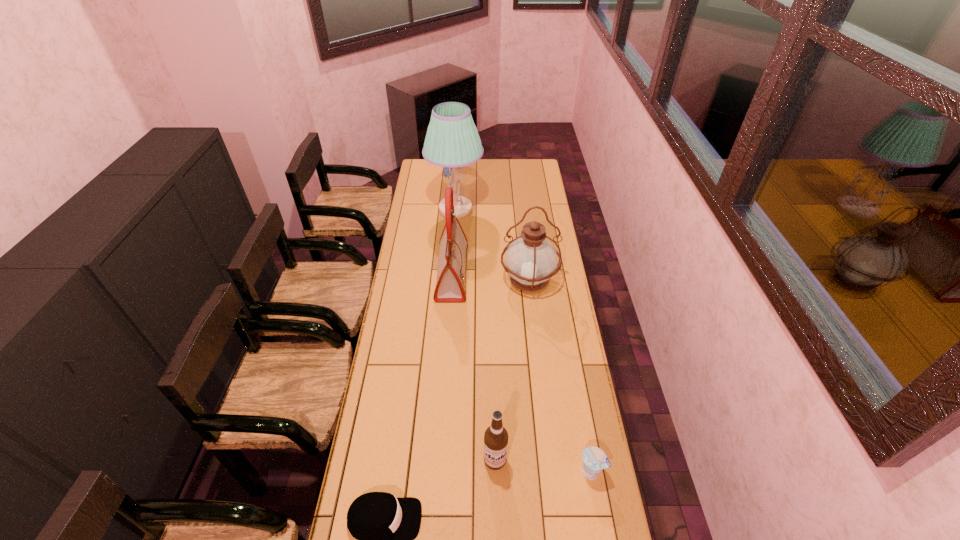
You are a GUI agent. You are given a task and a screenshot of the screen. Output one action in this format:
    pyautogui.click(x=<x>, y=<y>)
    Task: Click on the vacant space situated 0.320m on the back of the yogurt
    
    Given the screenshot: What is the action you would take?
    pyautogui.click(x=574, y=376)

Image resolution: width=960 pixels, height=540 pixels. What are the coordinates of `object that is at the left edge` in the screenshot? It's located at (452, 141).

Locate an element on the screen. The height and width of the screenshot is (540, 960). oil lamp that is at the right edge is located at coordinates (530, 259).

I want to click on yogurt that is at the right edge, so click(x=594, y=459).

Where is `vacant space at the far edge`? The width and height of the screenshot is (960, 540). vacant space at the far edge is located at coordinates (473, 178).

This screenshot has height=540, width=960. I want to click on free space at the left edge of the desktop, so click(407, 435).

In the image, there is a desktop. Identify the location of vacant space at the right edge. This screenshot has height=540, width=960. (567, 354).

Image resolution: width=960 pixels, height=540 pixels. Find the location of `free space between the fourth tallest object and the handbag`. free space between the fourth tallest object and the handbag is located at coordinates [x=473, y=366].

Image resolution: width=960 pixels, height=540 pixels. I want to click on vacant space in between the handbag and the oil lamp, so click(491, 276).

Locate an element on the screen. The width and height of the screenshot is (960, 540). vacant space in between the yogurt and the tallest object is located at coordinates (523, 340).